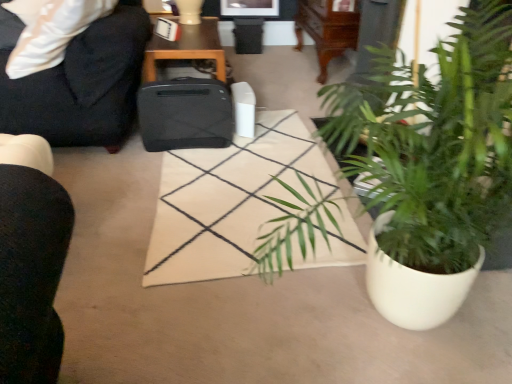
Question: Should I look upward or downward to see green leafy plant in white pot at lower right?

Choices:
 (A) up
 (B) down

Answer: (A)

Question: Is black matte printer at center outside of black fabric chair at upper left?

Choices:
 (A) no
 (B) yes

Answer: (B)

Question: Is black matte printer at center oriented towards black fabric chair at upper left?

Choices:
 (A) no
 (B) yes

Answer: (A)

Question: Does black matte printer at center have a lesser height compared to black fabric chair at upper left?

Choices:
 (A) yes
 (B) no

Answer: (A)

Question: Considering the relative sizes of black matte printer at center and black fabric chair at upper left in the image provided, is black matte printer at center bigger than black fabric chair at upper left?

Choices:
 (A) no
 (B) yes

Answer: (A)

Question: From a real-world perspective, does black matte printer at center stand above black fabric chair at upper left?

Choices:
 (A) yes
 (B) no

Answer: (B)

Question: Are black matte printer at center and black fabric chair at upper left far apart?

Choices:
 (A) yes
 (B) no

Answer: (B)

Question: Does black matte suitcase at center have a lesser width compared to black plastic trash can at center?

Choices:
 (A) no
 (B) yes

Answer: (B)

Question: Is the position of black matte suitcase at center more distant than that of black plastic trash can at center?

Choices:
 (A) yes
 (B) no

Answer: (B)

Question: From the image's perspective, is black matte suitcase at center beneath black plastic trash can at center?

Choices:
 (A) no
 (B) yes

Answer: (B)

Question: Is black matte suitcase at center looking in the opposite direction of black plastic trash can at center?

Choices:
 (A) no
 (B) yes

Answer: (B)

Question: Is black matte suitcase at center bigger than black plastic trash can at center?

Choices:
 (A) yes
 (B) no

Answer: (A)

Question: Would you say black plastic trash can at center is part of black matte suitcase at center's contents?

Choices:
 (A) yes
 (B) no

Answer: (B)

Question: Can you confirm if black wood table at upper center is smaller than black fabric chair at upper left?

Choices:
 (A) no
 (B) yes

Answer: (B)